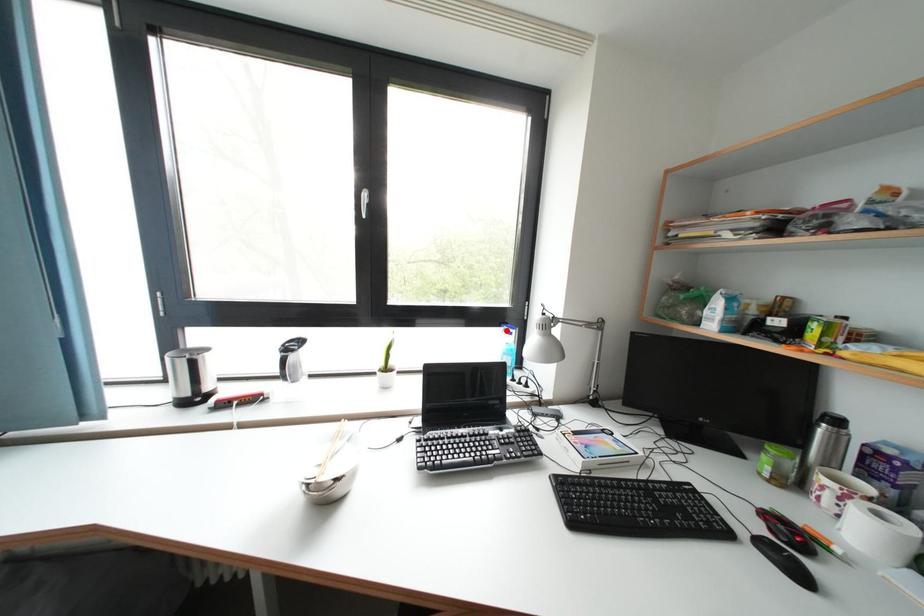
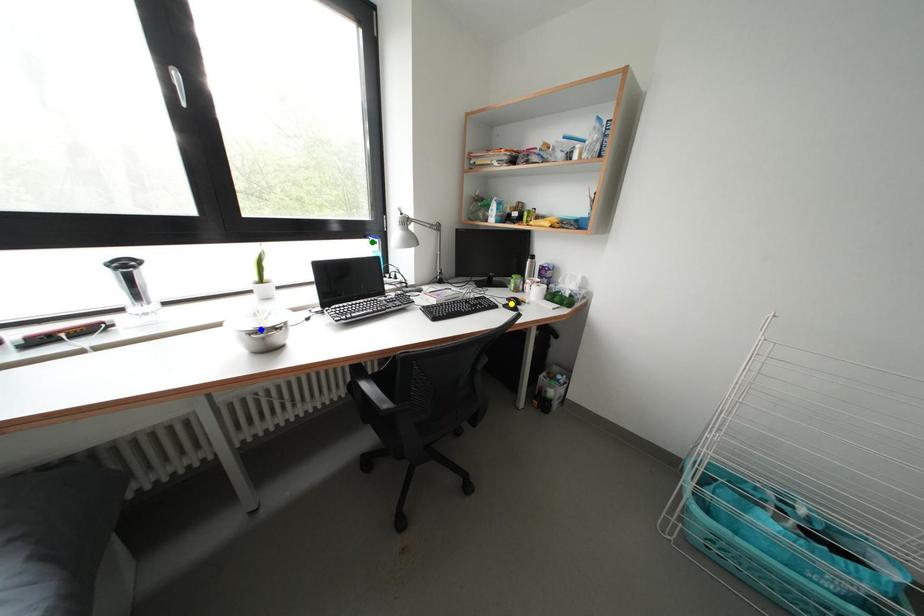
Question: I am providing you with two images of the same scene from different viewpoints. A red point is marked on the first image. You are given multiple points on the second image. Which point in image 2 is actually the same real-world point as the red point in image 1?

Choices:
 (A) blue point
 (B) green point
 (C) yellow point

Answer: (B)